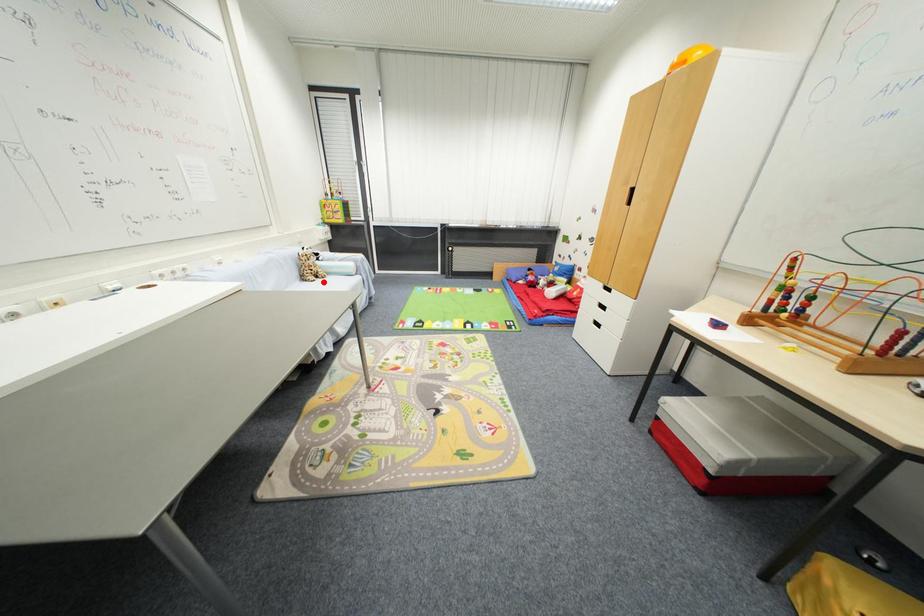
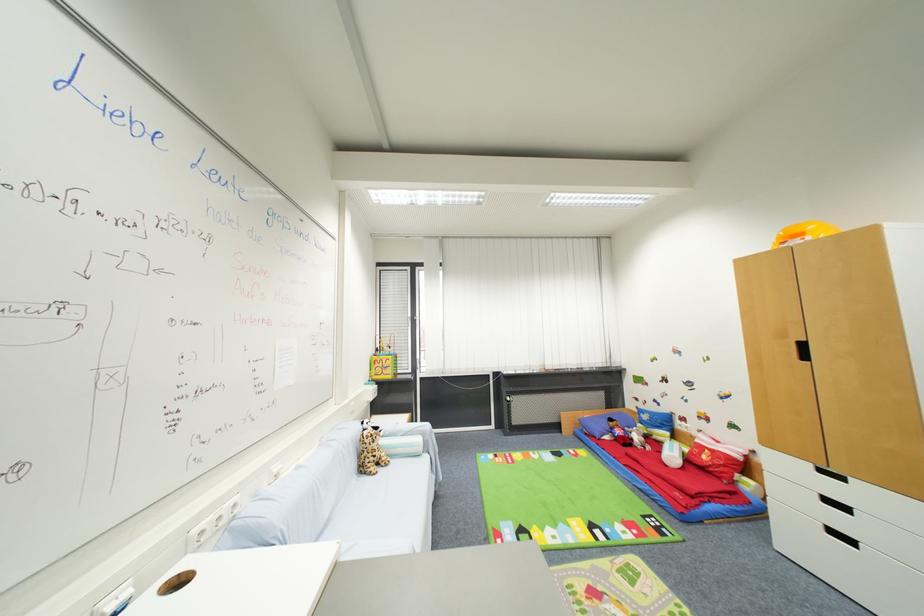
Question: I am providing you with two images of the same scene from different viewpoints. A red point is shown in image1. For the corresponding object point in image2, is it positioned nearer or farther from the camera?

Choices:
 (A) Nearer
 (B) Farther

Answer: (B)